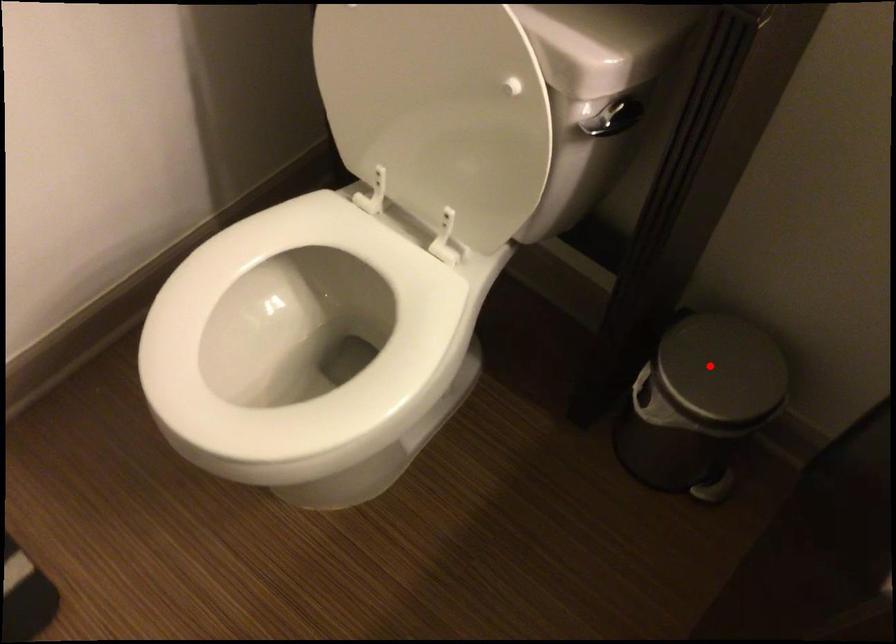
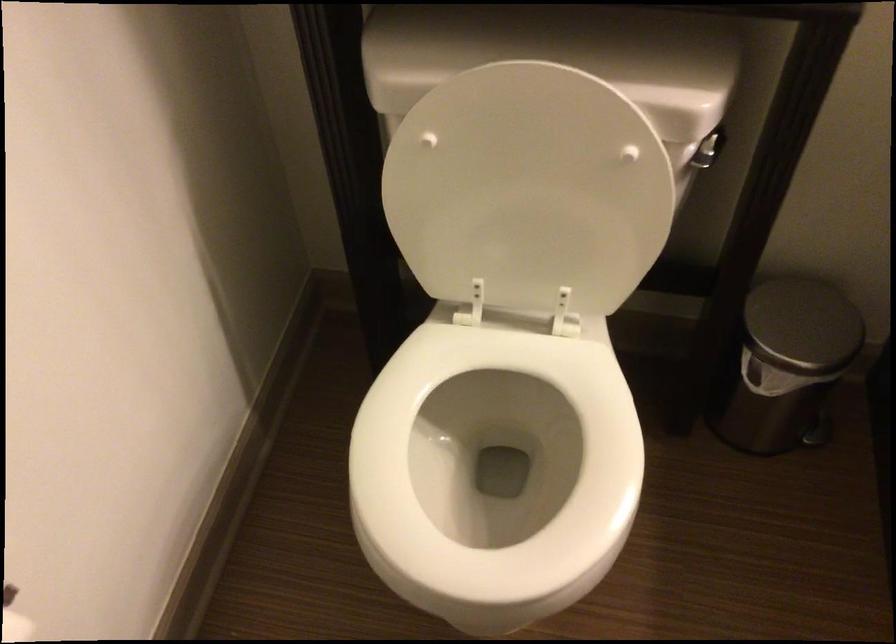
Question: I am providing you with two images of the same scene from different viewpoints. Image1 has a red point marked. In image2, the corresponding 3D location appears at what relative position? Reply with the corresponding letter.

Choices:
 (A) Closer
 (B) Farther

Answer: (B)